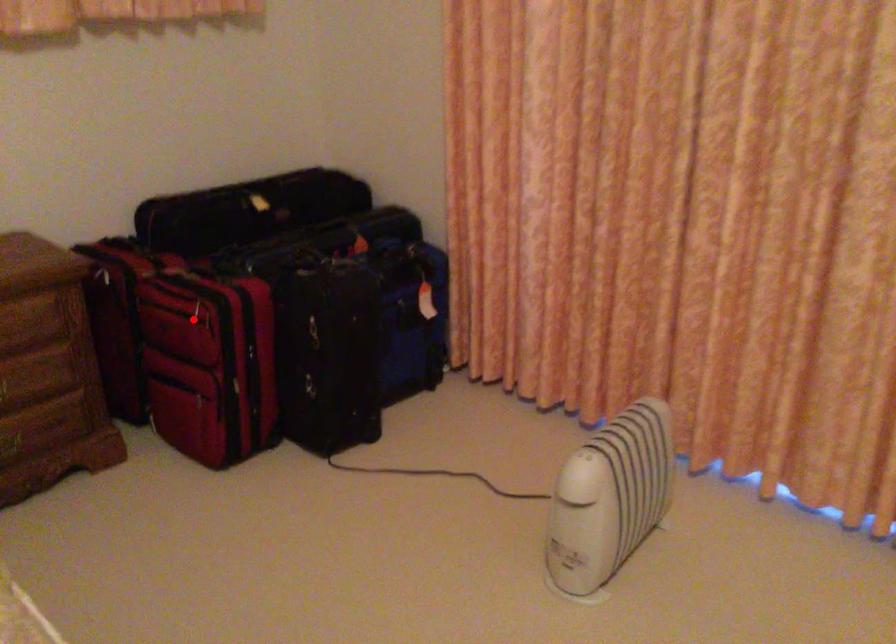
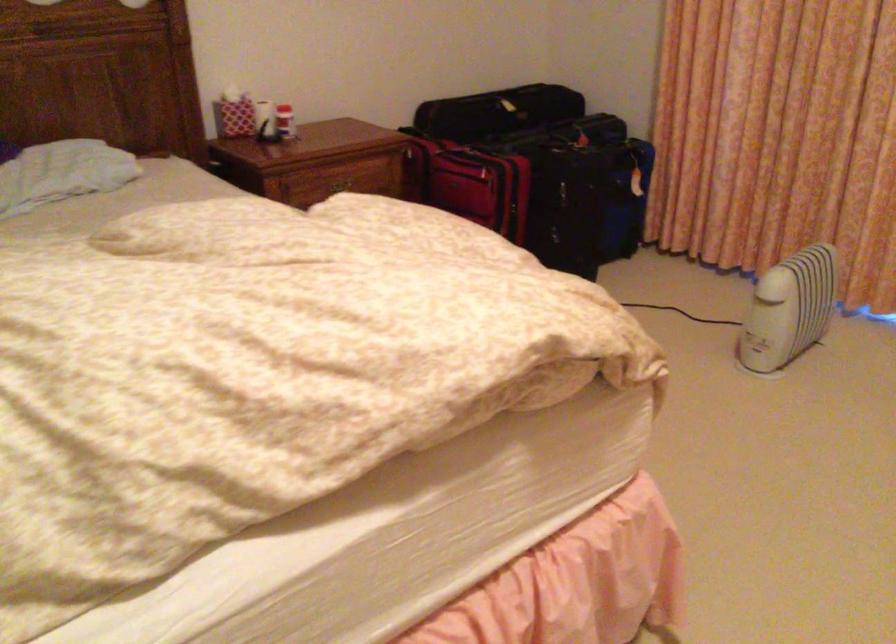
The point at the highlighted location is marked in the first image. Where is the corresponding point in the second image?

(469, 183)